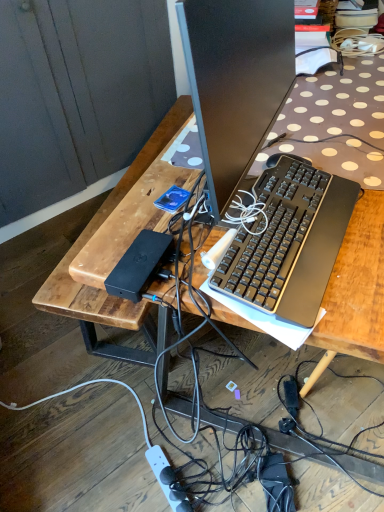
Question: Considering the relative positions of white plastic power outlet at lower center and black plastic keyboard at center in the image provided, is white plastic power outlet at lower center in front of black plastic keyboard at center?

Choices:
 (A) yes
 (B) no

Answer: (B)

Question: Can you confirm if white plastic power outlet at lower center is bigger than black plastic keyboard at center?

Choices:
 (A) no
 (B) yes

Answer: (A)

Question: From the image's perspective, does white plastic power outlet at lower center appear lower than black plastic keyboard at center?

Choices:
 (A) yes
 (B) no

Answer: (A)

Question: Considering the relative sizes of white plastic power outlet at lower center and black plastic keyboard at center in the image provided, is white plastic power outlet at lower center shorter than black plastic keyboard at center?

Choices:
 (A) yes
 (B) no

Answer: (A)

Question: Is black plastic keyboard at center located within white plastic power outlet at lower center?

Choices:
 (A) no
 (B) yes

Answer: (A)

Question: Considering the relative sizes of white plastic power outlet at lower center and black plastic keyboard at center in the image provided, is white plastic power outlet at lower center smaller than black plastic keyboard at center?

Choices:
 (A) yes
 (B) no

Answer: (A)

Question: Is wooden desk at center bigger than black plastic keyboard at center?

Choices:
 (A) no
 (B) yes

Answer: (B)

Question: From a real-world perspective, is wooden desk at center over black plastic keyboard at center?

Choices:
 (A) no
 (B) yes

Answer: (A)

Question: Is wooden desk at center aimed at black plastic keyboard at center?

Choices:
 (A) no
 (B) yes

Answer: (A)

Question: Is black plastic keyboard at center at the back of wooden desk at center?

Choices:
 (A) yes
 (B) no

Answer: (B)

Question: Does wooden desk at center have a greater width compared to black plastic keyboard at center?

Choices:
 (A) yes
 (B) no

Answer: (A)

Question: From the image's perspective, is wooden desk at center under black plastic keyboard at center?

Choices:
 (A) no
 (B) yes

Answer: (A)

Question: From a real-world perspective, is black plastic keyboard at center positioned under white plastic power outlet at lower center based on gravity?

Choices:
 (A) yes
 (B) no

Answer: (B)